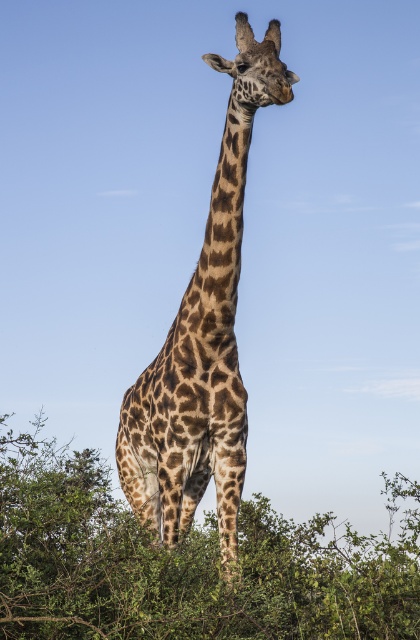
Does green leafy bush at center come in front of spotted fur giraffe at center?

No, it is not.

Which is behind, point (396, 632) or point (170, 346)?

The point (170, 346) is behind.

Is point (322, 515) positioned in front of point (207, 344)?

No.

You are a GUI agent. You are given a task and a screenshot of the screen. Output one action in this format:
    pyautogui.click(x=<x>, y=<y>)
    Task: Click on the green leafy bush at center
    The height and width of the screenshot is (640, 420).
    Given the screenshot: What is the action you would take?
    click(x=183, y=564)